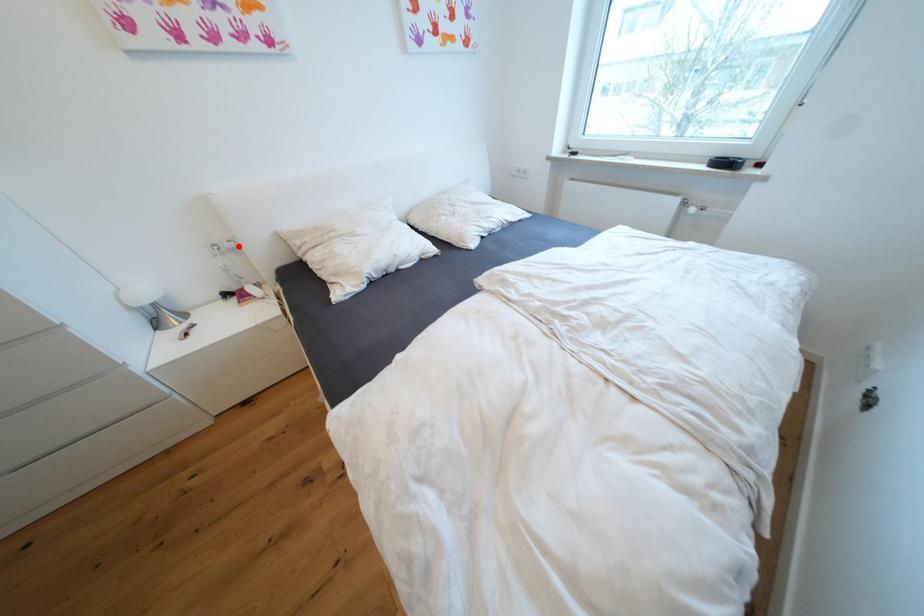
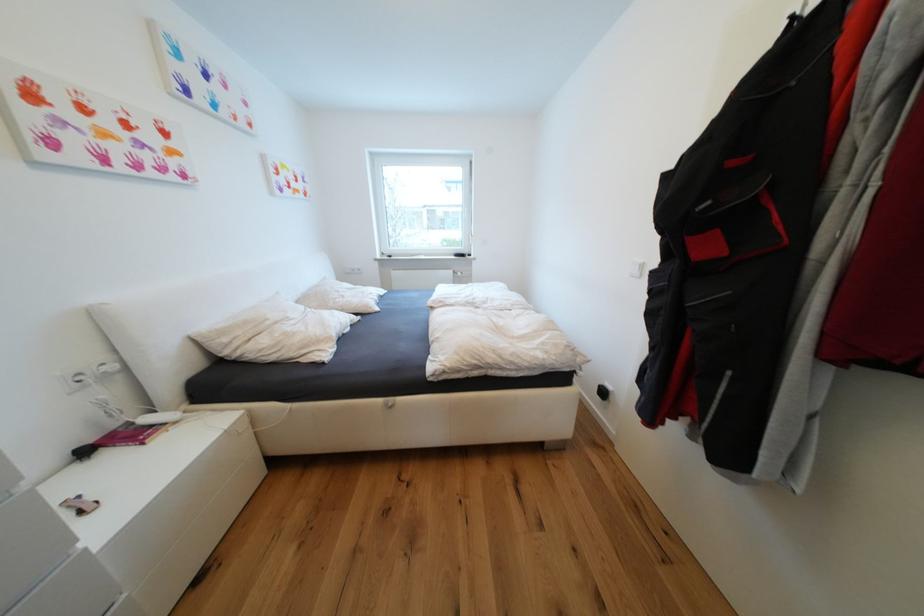
Question: I am providing you with two images of the same scene from different viewpoints. Image1 has a red point marked. In image2, the corresponding 3D location appears at what relative position? Reply with the corresponding letter.

Choices:
 (A) Closer
 (B) Farther

Answer: (B)